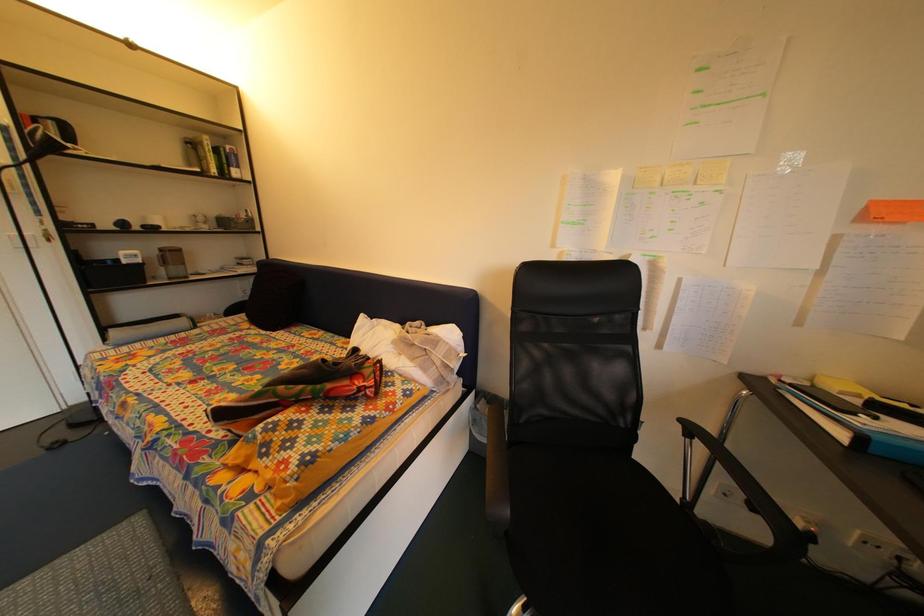
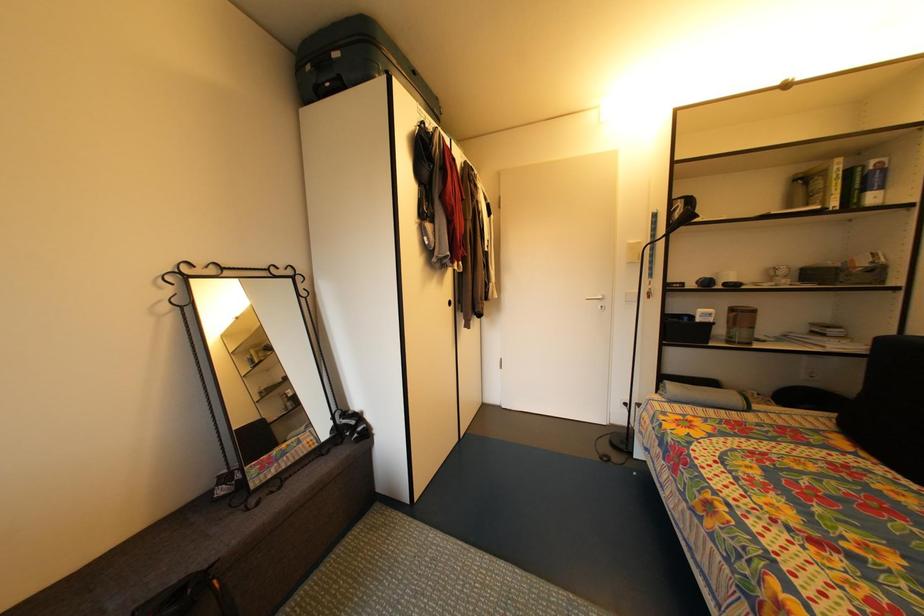
Question: The camera is either moving clockwise (left) or counter-clockwise (right) around the object. The first image is from the beginning of the video and the second image is from the end. Is the camera moving left or right when shooting the video?

Choices:
 (A) Left
 (B) Right

Answer: (B)